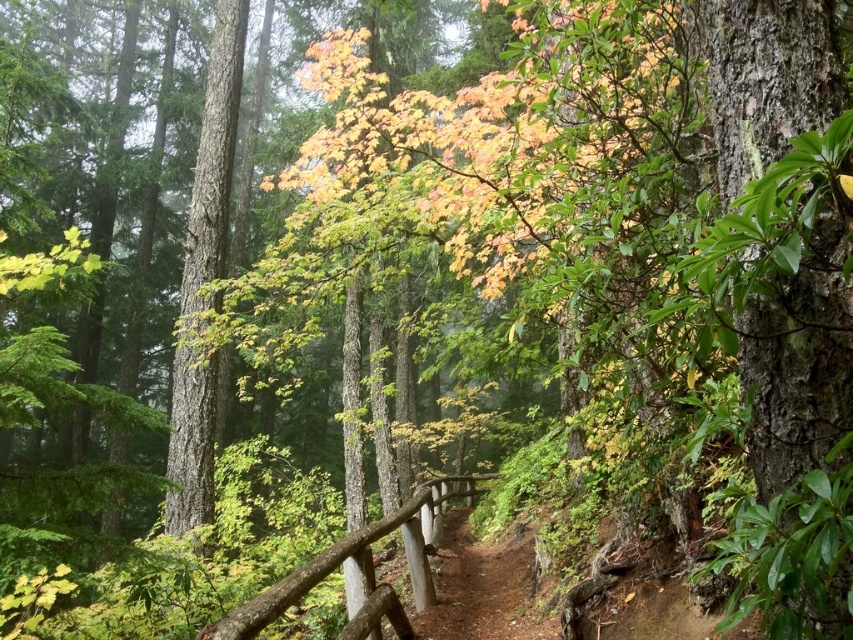
You are standing at the point marked as point (482, 588) in the forest scene. Which surface are you standing on?

The point (482, 588) is on the brown dirt trail at center, so you are standing on the dirt trail.

You are a hiker planning to walk along the brown dirt trail at center and the brown wood rail at center. Which one is shorter in length?

The brown dirt trail at center is shorter than the brown wood rail at center.